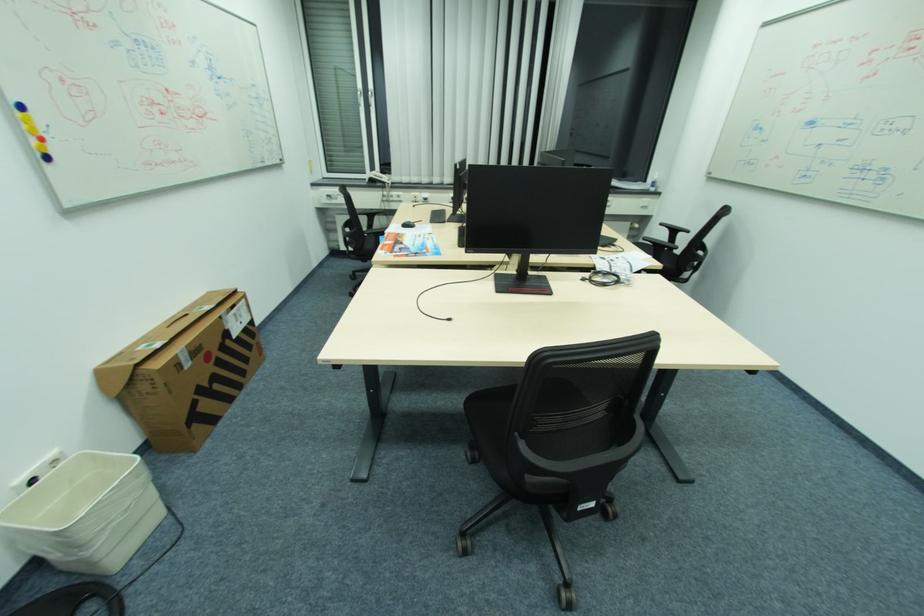
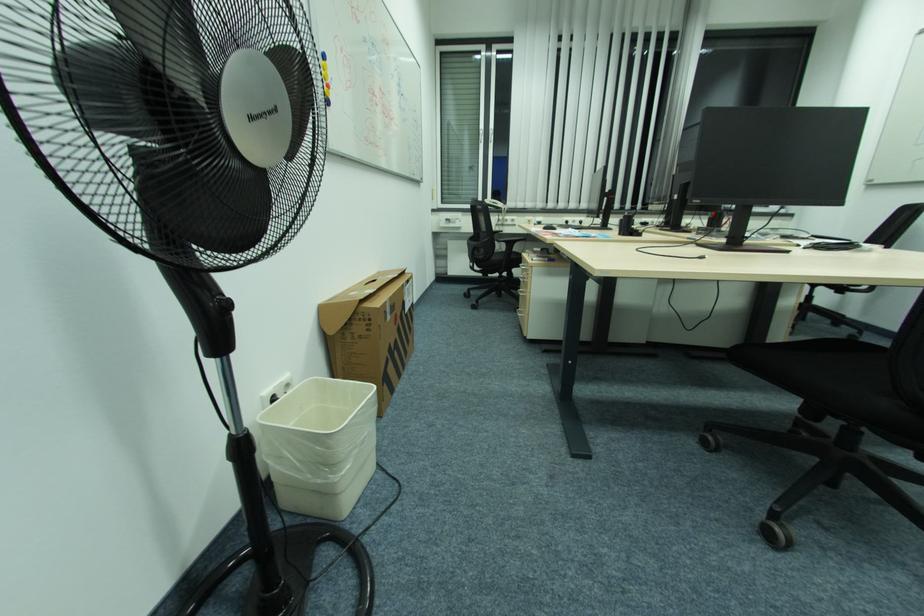
Question: How did the camera likely rotate?

Choices:
 (A) Left
 (B) Right
 (C) Up
 (D) Down

Answer: (C)